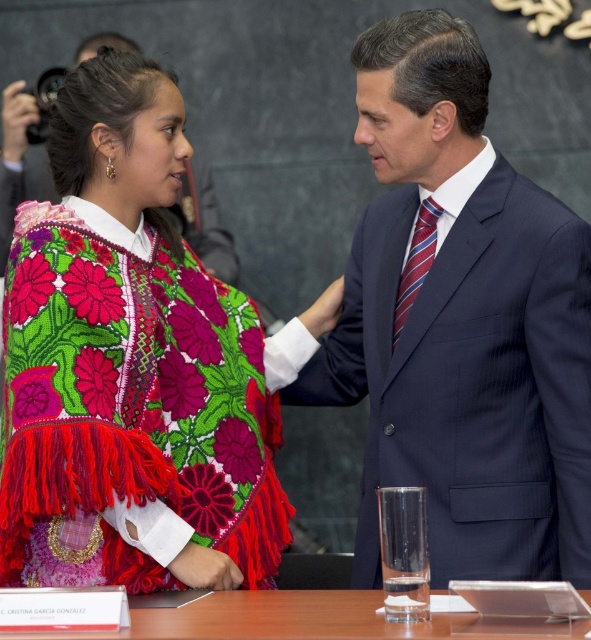
You are an event planner setting up a conference room. You need to place a decorative item on the table between the embroidered wool poncho at center and the transparent glass at center. Which side of the table should you place it to ensure it is closer to the viewer?

The embroidered wool poncho at center is closer to the viewer than the transparent glass at center. Therefore, placing the decorative item on the side of the table near the embroidered wool poncho at center will make it closer to the viewer.

In the scene shown: You are a photographer setting up for a formal portrait. You need to ensure that the embroidered wool poncho at center and the transparent glass at center are both in focus. The depth of field in your camera can cover objects within a 50 cm range. Will both items be in focus?

The distance between the embroidered wool poncho at center and the transparent glass at center is 53.44 centimeters. Since the depth of field can only cover 50 cm, the two items are slightly out of the required range. Therefore, both items may not be in focus simultaneously.